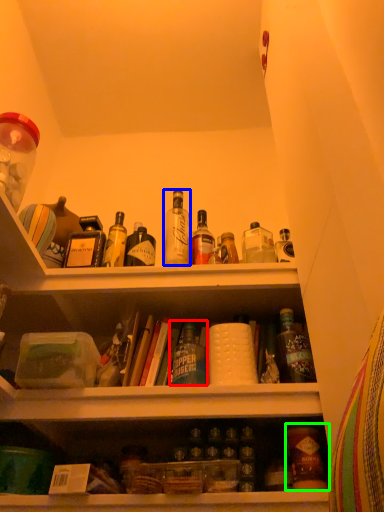
Question: Which object is positioned closest to bottle (highlighted by a red box)? Select from bottle (highlighted by a blue box) and bottle (highlighted by a green box).

Choices:
 (A) bottle
 (B) bottle

Answer: (B)